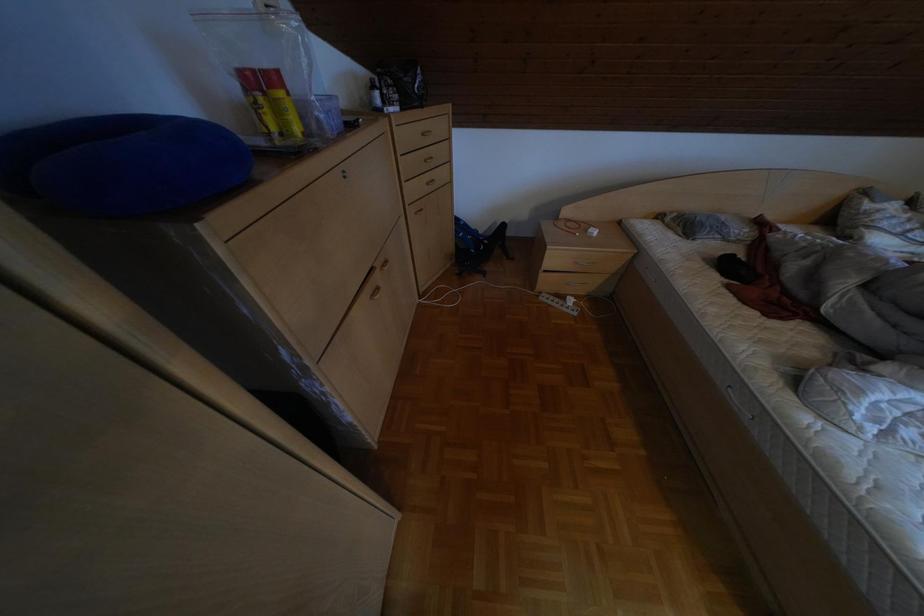
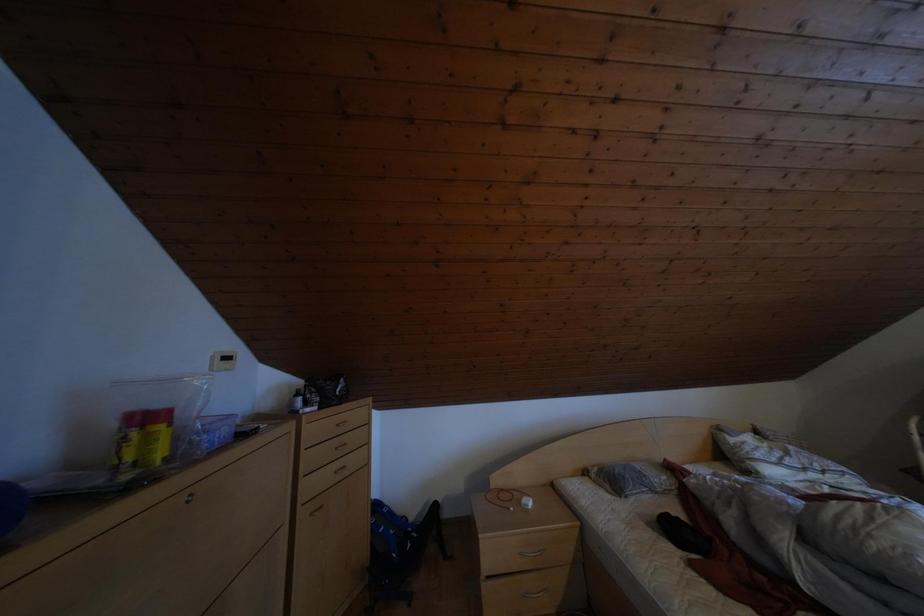
Based on the photo, based on the continuous images, in which direction is the camera rotating?

The rotation direction of the camera is right-up.